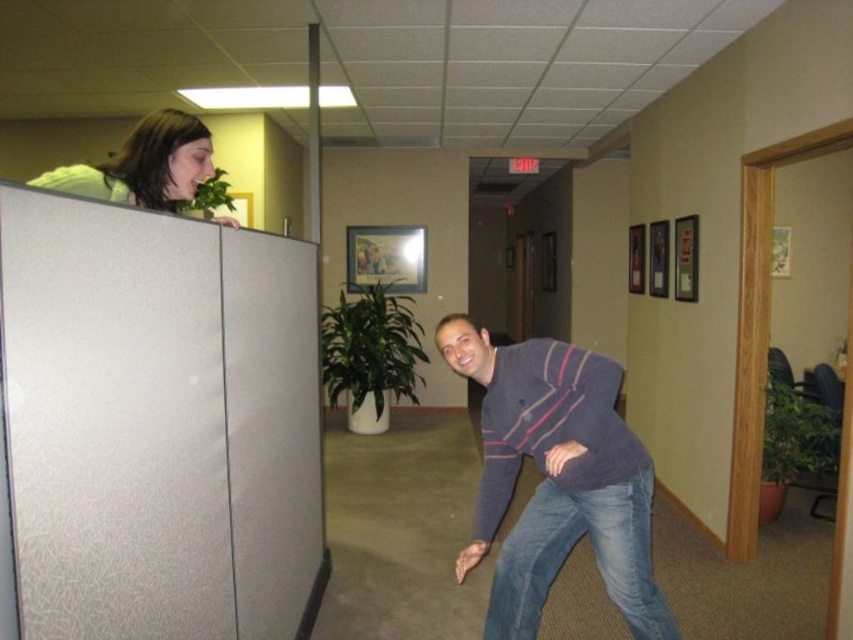
Question: Which point is closer to the camera?

Choices:
 (A) matte white hair at upper left
 (B) dark blue sweater at center

Answer: (A)

Question: Is dark blue sweater at center closer to camera compared to matte white hair at upper left?

Choices:
 (A) no
 (B) yes

Answer: (A)

Question: Is dark blue sweater at center positioned at the back of matte white hair at upper left?

Choices:
 (A) no
 (B) yes

Answer: (B)

Question: Is dark blue sweater at center smaller than matte white hair at upper left?

Choices:
 (A) no
 (B) yes

Answer: (A)

Question: Which object is closer to the camera taking this photo?

Choices:
 (A) matte white hair at upper left
 (B) dark blue sweater at center

Answer: (A)